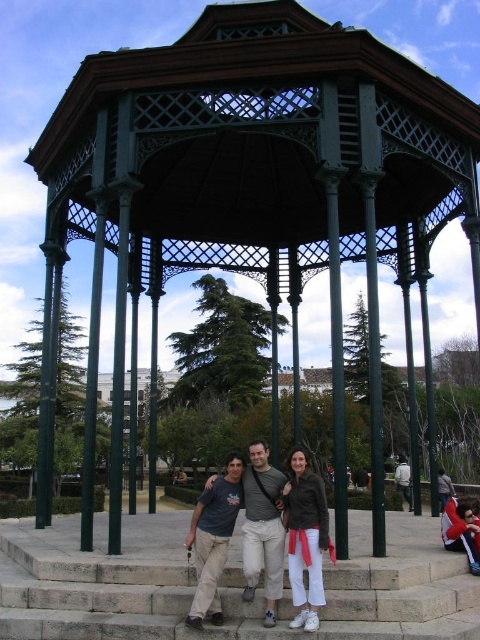
In the scene shown: Who is more forward, (387, 604) or (203, 528)?

Point (387, 604)

Is point (9, 582) positioned behind point (200, 496)?

No, (9, 582) is closer to viewer.

Locate an element on the screen. The width and height of the screenshot is (480, 640). stone steps at center is located at coordinates (226, 596).

Is matte brown jacket at center closer to camera compared to white matte jacket at center?

Yes.

The width and height of the screenshot is (480, 640). What do you see at coordinates (305, 538) in the screenshot?
I see `matte brown jacket at center` at bounding box center [305, 538].

Find the location of a particular element. This screenshot has height=640, width=480. matte brown jacket at center is located at coordinates (305, 538).

Identify the location of matte brown jacket at center. The height and width of the screenshot is (640, 480). (305, 538).

In the scene shown: Can you confirm if gray cotton t-shirt at center is smaller than dark gray t-shirt at center?

No.

This screenshot has height=640, width=480. Identify the location of gray cotton t-shirt at center. (263, 529).